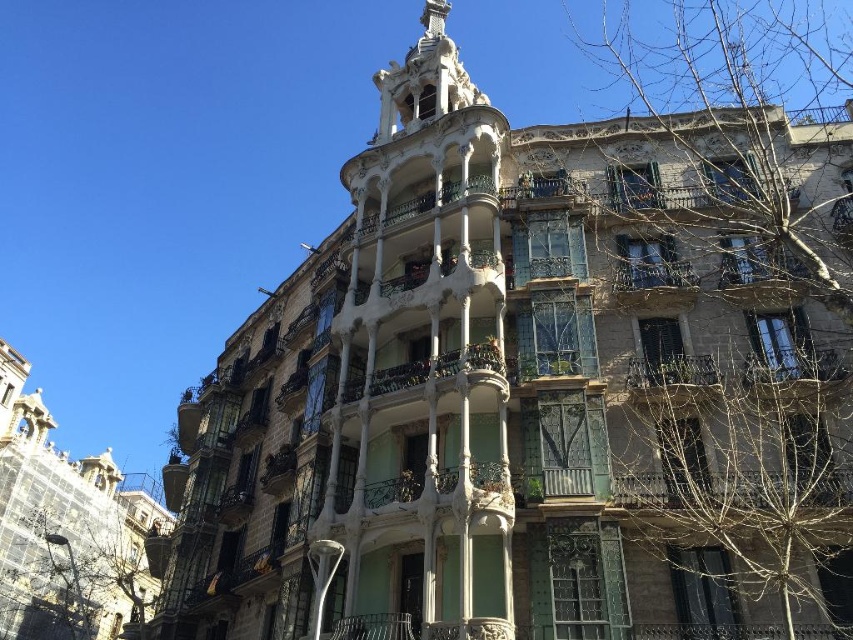
Question: Based on their relative distances, which object is farther from the rustic wrought iron balcony at center right?

Choices:
 (A) green wrought iron balcony at center
 (B) green wrought iron balcony at upper right
 (C) green wrought iron balcony at upper center
 (D) rustic wrought iron balcony at center

Answer: (A)

Question: Is rustic wrought iron balcony at center right further to the viewer compared to green wrought iron balcony at center?

Choices:
 (A) no
 (B) yes

Answer: (A)

Question: Which point is farther to the camera?

Choices:
 (A) (792, 378)
 (B) (630, 365)
 (C) (764, 304)

Answer: (C)

Question: Considering the relative positions of rustic wrought iron balcony at center right and rustic wrought iron balcony at center in the image provided, where is rustic wrought iron balcony at center right located with respect to rustic wrought iron balcony at center?

Choices:
 (A) left
 (B) right

Answer: (B)

Question: Which object is closer to the camera taking this photo?

Choices:
 (A) rustic wrought iron balcony at center
 (B) green wrought iron balcony at center

Answer: (A)

Question: Is green wrought iron balcony at upper center to the left of rustic wrought iron balcony at center from the viewer's perspective?

Choices:
 (A) yes
 (B) no

Answer: (B)